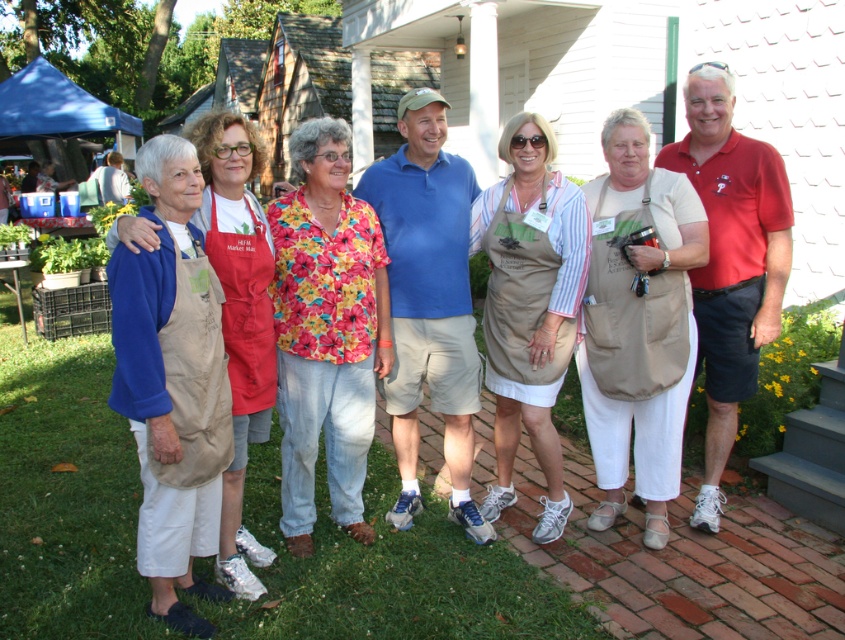
Question: Which of the following is the farthest from the observer?

Choices:
 (A) (617, 416)
 (B) (166, 241)

Answer: (A)

Question: Does beige fabric apron at left appear on the left side of tan fabric apron at center?

Choices:
 (A) no
 (B) yes

Answer: (B)

Question: Is beige fabric apron at left to the right of tan fabric apron at center from the viewer's perspective?

Choices:
 (A) yes
 (B) no

Answer: (B)

Question: Is beige fabric apron at left thinner than tan fabric apron at center?

Choices:
 (A) no
 (B) yes

Answer: (B)